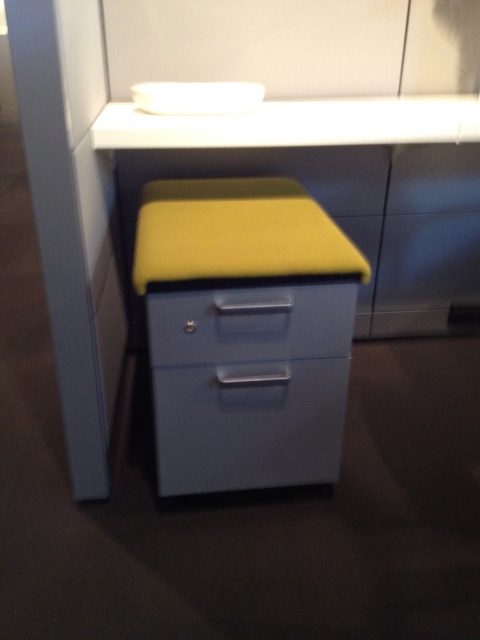
Looking at this image, you are organizing a small workspace and need to place a 1.2 meter tall plant stand. The yellow fabric drawer at center and the white glossy counter top at upper center are in your view. Which object can accommodate the plant stand in terms of height?

The yellow fabric drawer at center is much taller than the white glossy counter top at upper center, so the plant stand can be placed on the yellow fabric drawer at center since it has sufficient height.

Looking at this image, you are a drone operator trying to navigate between two points in the workspace. The first point is at point (202, 340) and the second point is at point (229, 291). Which point is closer to the observer?

Point (229, 291) is closer to the observer because point (202, 340) is behind it.